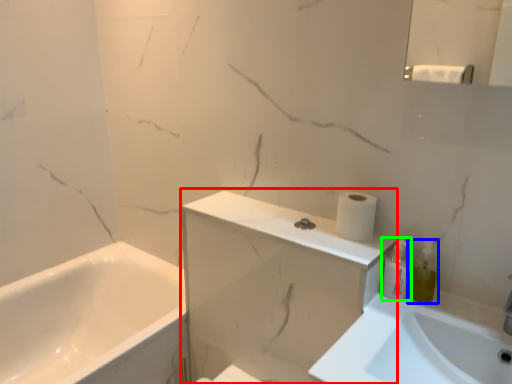
Question: Which object is positioned farthest from medicine cabinet (highlighted by a red box)? Select from soap dispenser (highlighted by a blue box) and toiletry (highlighted by a green box).

Choices:
 (A) soap dispenser
 (B) toiletry

Answer: (A)